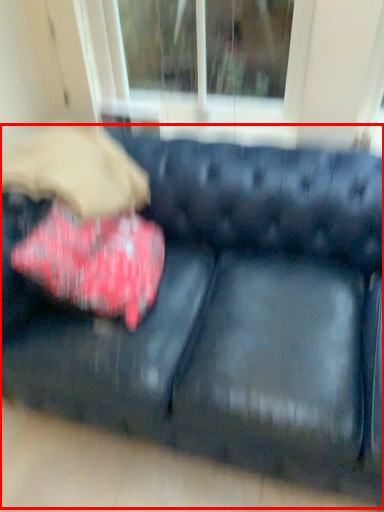
Question: Considering the relative positions of studio couch (annotated by the red box) and throw pillow in the image provided, where is studio couch (annotated by the red box) located with respect to the staircase?

Choices:
 (A) right
 (B) left

Answer: (A)